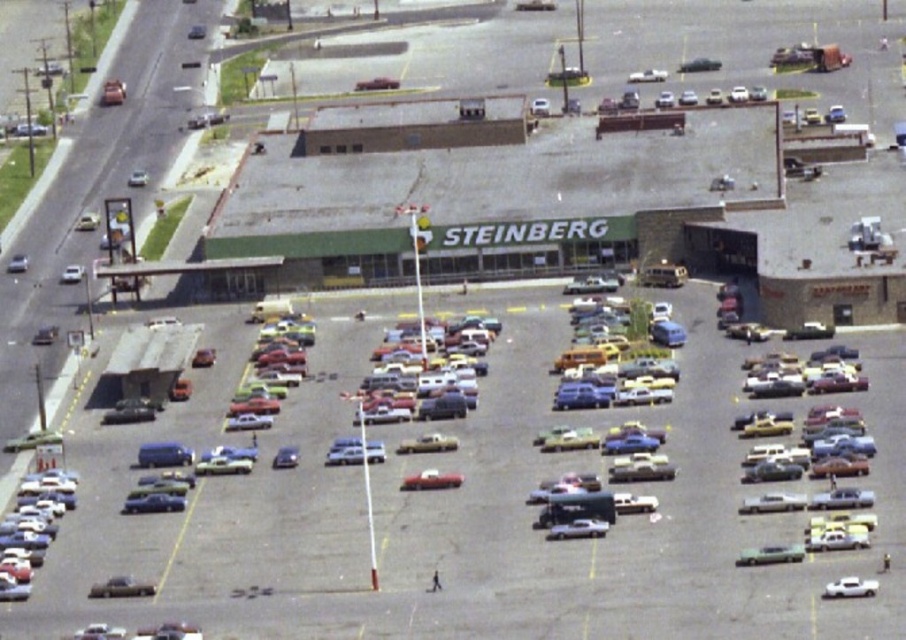
Question: Among these points, which one is nearest to the camera?

Choices:
 (A) (661, 268)
 (B) (147, 589)

Answer: (B)

Question: Considering the real-world distances, which object is farthest from the shiny red car at center?

Choices:
 (A) silver metallic pickup truck at center
 (B) metallic silver van at center
 (C) shiny silver sedan at lower left

Answer: (B)

Question: Is shiny silver car at lower left above white matte truck at lower right?

Choices:
 (A) no
 (B) yes

Answer: (A)

Question: Where is metallic silver van at center located in relation to matte black car at center in the image?

Choices:
 (A) left
 (B) right

Answer: (B)

Question: Which point is closer to the camera taking this photo?

Choices:
 (A) (400, 451)
 (B) (40, 513)
 (C) (170, 465)

Answer: (B)

Question: From the image, what is the correct spatial relationship of shiny silver car at lower left in relation to silver metallic pickup truck at center?

Choices:
 (A) below
 (B) above

Answer: (A)